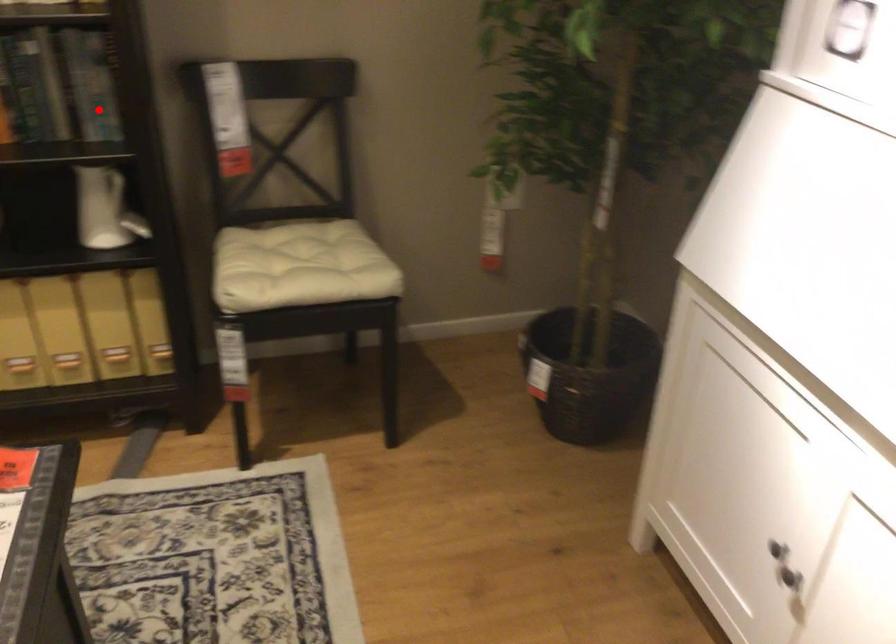
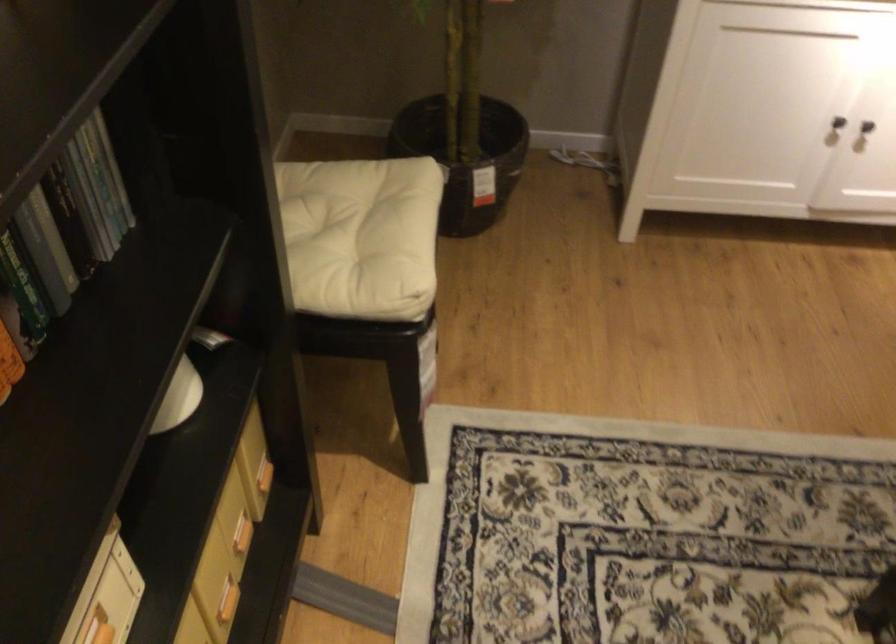
Where in the second image is the point corresponding to the highlighted location from the first image?

(95, 198)